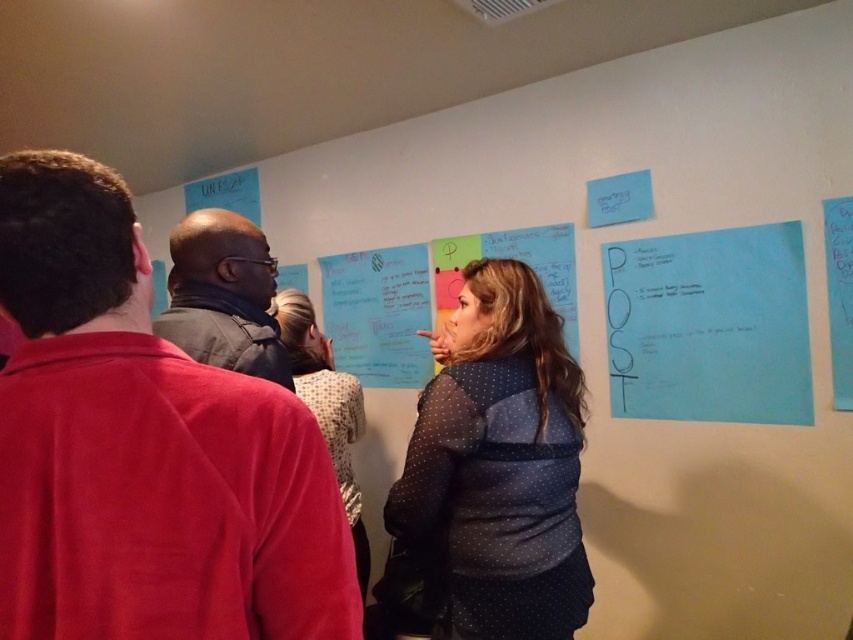
Question: Which point is closer to the camera taking this photo?

Choices:
 (A) (379, 369)
 (B) (184, 396)

Answer: (B)

Question: Does red fabric shirt at left have a larger size compared to blue paper at upper right?

Choices:
 (A) no
 (B) yes

Answer: (A)

Question: Is polka dot fabric jacket at center above white paper at upper center?

Choices:
 (A) no
 (B) yes

Answer: (A)

Question: Which point is farther to the camera?

Choices:
 (A) (241, 209)
 (B) (252, 372)
 (C) (616, 308)

Answer: (A)

Question: Is blue paper at upper right above white paper at upper center?

Choices:
 (A) no
 (B) yes

Answer: (A)

Question: Which point is closer to the camera?

Choices:
 (A) (654, 259)
 (B) (347, 454)
 (C) (508, 456)
 (D) (222, 211)

Answer: (D)